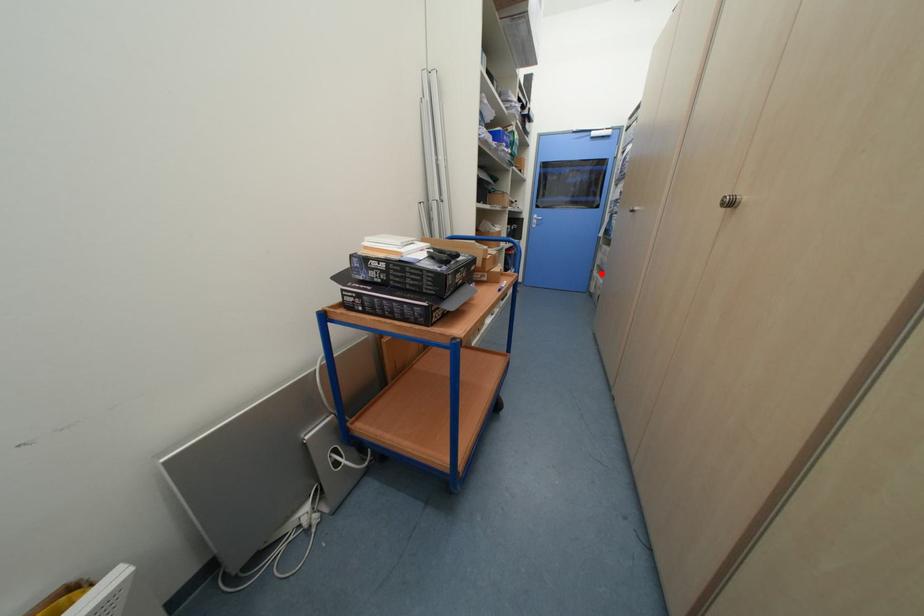
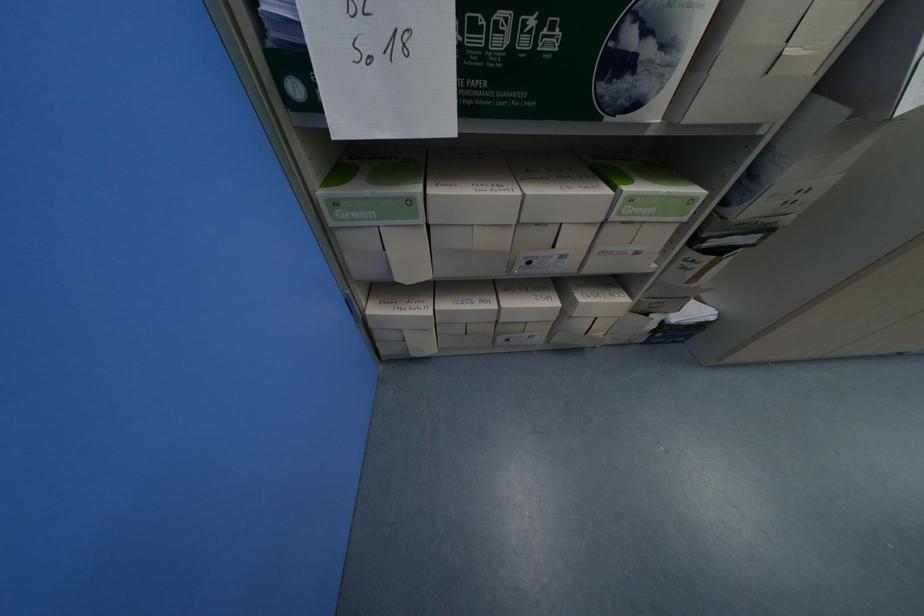
Question: I am providing you with two images of the same scene from different viewpoints. A red point is shown in image1. For the corresponding object point in image2, is it positioned nearer or farther from the camera?

Choices:
 (A) Nearer
 (B) Farther

Answer: (B)